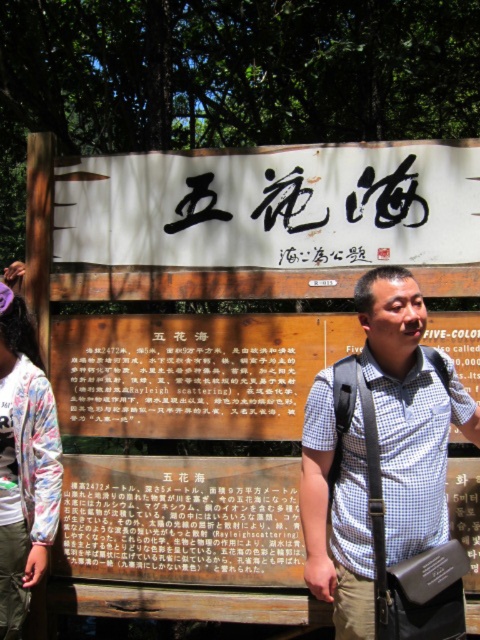
Question: Which object is positioned farthest from the black paper at center?

Choices:
 (A) wooden signboard at center
 (B) white checkered shirt at center
 (C) matte brown signboard at center
 (D) printed fabric shirt at left

Answer: (B)

Question: Which object appears farthest from the camera in this image?

Choices:
 (A) black paper at center
 (B) white checkered shirt at center
 (C) printed fabric shirt at left
 (D) wooden signboard at center

Answer: (A)

Question: Does white checkered shirt at center come in front of black paper at center?

Choices:
 (A) no
 (B) yes

Answer: (B)

Question: Is white checkered shirt at center to the left of matte brown signboard at center from the viewer's perspective?

Choices:
 (A) yes
 (B) no

Answer: (B)

Question: Based on their relative distances, which object is nearer to the white checkered shirt at center?

Choices:
 (A) matte brown signboard at center
 (B) wooden signboard at center
 (C) black paper at center

Answer: (C)

Question: Can you confirm if wooden signboard at center is smaller than printed fabric shirt at left?

Choices:
 (A) yes
 (B) no

Answer: (A)